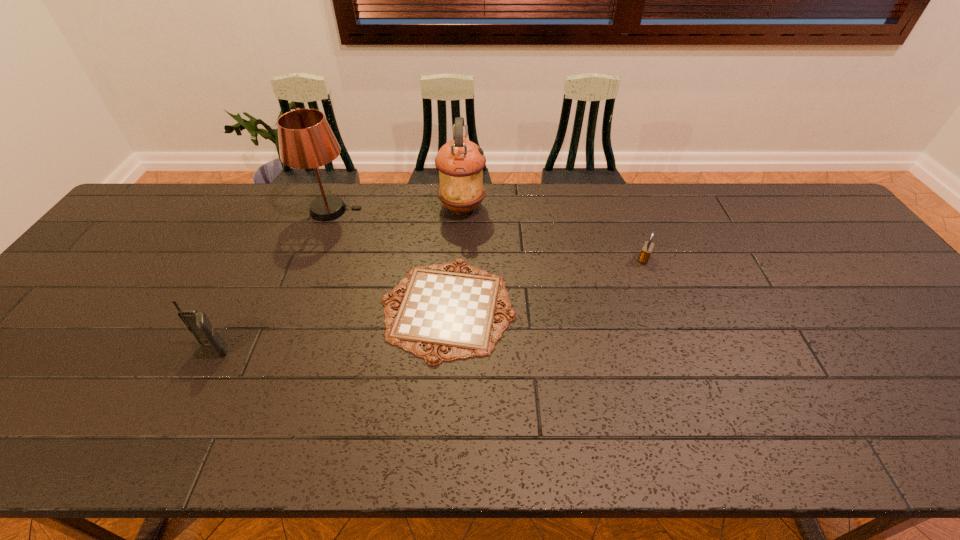
The width and height of the screenshot is (960, 540). I want to click on free space located 0.320m on the left of the second shortest object, so click(524, 259).

Locate an element on the screen. This screenshot has width=960, height=540. free spot located on the left of the chessboard is located at coordinates (302, 308).

Identify the location of lampshade that is at the far edge. point(306,140).

At what (x,y) coordinates should I click in order to perform the action: click on oil lamp located in the far edge section of the desktop. Please return your answer as a coordinate pair (x, y). The height and width of the screenshot is (540, 960). Looking at the image, I should click on (460, 162).

This screenshot has height=540, width=960. I want to click on vacant space at the far edge of the desktop, so click(x=739, y=213).

Image resolution: width=960 pixels, height=540 pixels. In the image, there is a desktop. What are the coordinates of `free space at the near edge` in the screenshot? It's located at (302, 418).

I want to click on vacant space at the left edge, so click(148, 238).

The width and height of the screenshot is (960, 540). Identify the location of vacant space at the right edge of the desktop. (907, 343).

Identify the location of vacant space at the far right corner of the desktop. coord(777,212).

You are a GUI agent. You are given a task and a screenshot of the screen. Output one action in this format:
    pyautogui.click(x=<x>, y=<y>)
    Task: Click on the free space between the third shortest object and the oil lamp
    The width and height of the screenshot is (960, 540).
    Given the screenshot: What is the action you would take?
    pyautogui.click(x=338, y=279)